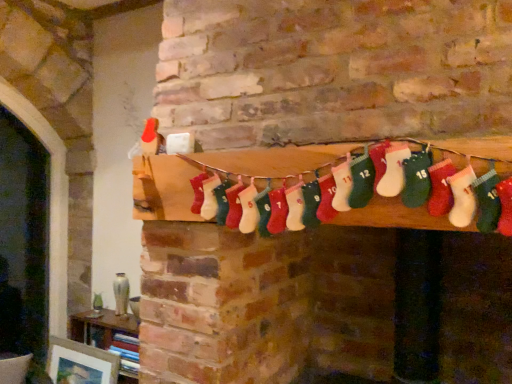
Question: Considering the positions of red knitted stocking at center and matte white picture frame at lower left in the image, is red knitted stocking at center taller or shorter than matte white picture frame at lower left?

Choices:
 (A) tall
 (B) short

Answer: (B)

Question: From the image's perspective, is red knitted stocking at center positioned above or below matte white picture frame at lower left?

Choices:
 (A) below
 (B) above

Answer: (B)

Question: Which object is positioned farthest from the matte white picture frame at lower left?

Choices:
 (A) red knitted stocking at center
 (B) wooden bookshelf at lower left

Answer: (A)

Question: Considering the real-world distances, which object is farthest from the matte white picture frame at lower left?

Choices:
 (A) red knitted stocking at center
 (B) wooden bookshelf at lower left

Answer: (A)